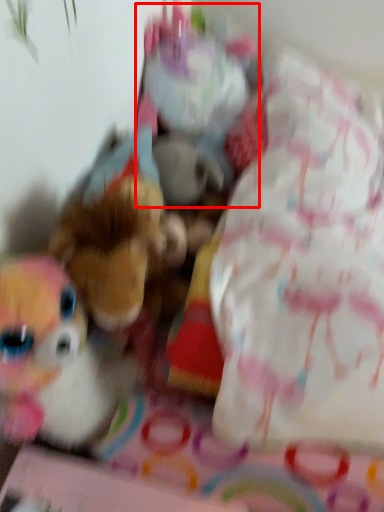
Question: Where is toy (annotated by the red box) located in relation to toy in the image?

Choices:
 (A) right
 (B) left

Answer: (A)